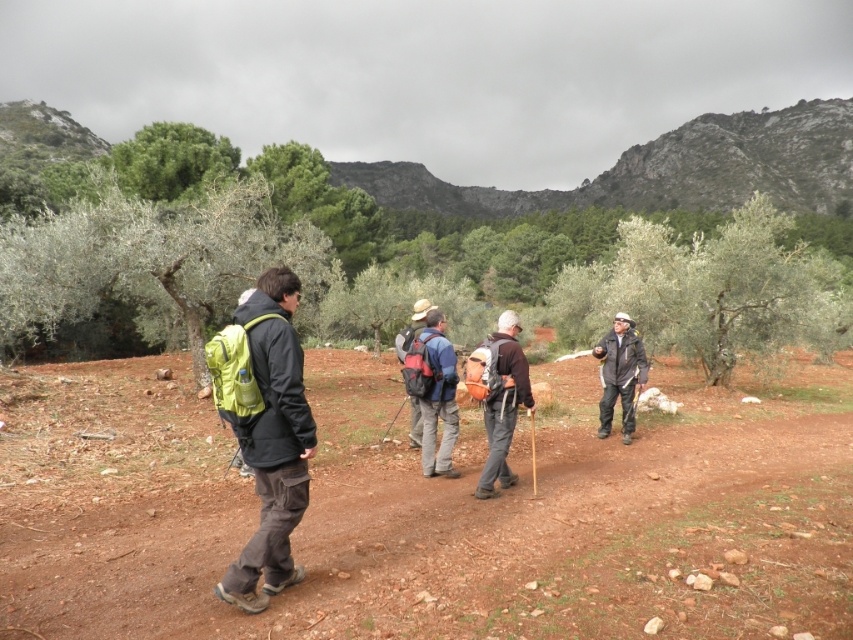
You are a hiker who wants to place a 4 meter long tent pole between the brown dirt field at center and the dark gray jacket at center. Can you fit the tent pole horizontally between them without bending it?

The distance between the brown dirt field at center and the dark gray jacket at center is 3.82 meters. Since the tent pole is 4 meters long, it cannot be placed horizontally between them without bending it because the space is shorter than the pole.

You are a hiker who wants to take a photo of the green leafy tree at center from where you are standing. The camera you are using has a maximum focus range of 40 feet. Will you be able to focus on the tree?

The distance between the green leafy tree at center and the camera is 43.18 feet, which exceeds the camera maximum focus range of 40 feet. Therefore, the camera cannot focus on the tree.

You are a hiker trying to locate your backpack. You see a green leafy tree at center and a matte green backpack at left. Which object is closer to you?

The green leafy tree at center is closer to you because the matte green backpack at left is behind it.